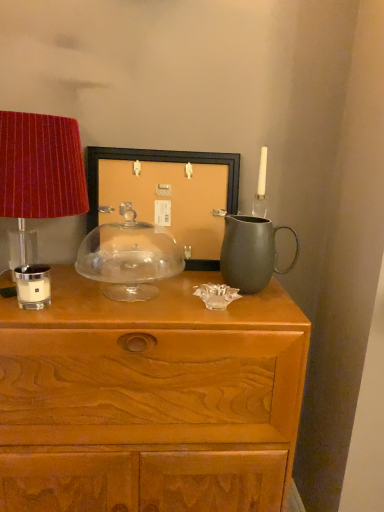
Question: Can we say transparent glass cake stand at center, arranged as the second candle holder when viewed from the left, lies outside matte black picture frame at center?

Choices:
 (A) yes
 (B) no

Answer: (A)

Question: Can you confirm if transparent glass cake stand at center, which is the 1th candle holder from right to left, is smaller than matte black picture frame at center?

Choices:
 (A) yes
 (B) no

Answer: (A)

Question: Considering the relative sizes of transparent glass cake stand at center, which is the 1th candle holder from right to left, and matte black picture frame at center in the image provided, is transparent glass cake stand at center, which is the 1th candle holder from right to left, shorter than matte black picture frame at center?

Choices:
 (A) no
 (B) yes

Answer: (B)

Question: Is transparent glass cake stand at center, which is the 1th candle holder from back to front, at the right side of matte black picture frame at center?

Choices:
 (A) yes
 (B) no

Answer: (B)

Question: Is transparent glass cake stand at center, which is the 1th candle holder from back to front, far from matte black picture frame at center?

Choices:
 (A) no
 (B) yes

Answer: (A)

Question: Is matte black picture frame at center to the left or to the right of transparent glass cake stand at center, placed as the second candle holder when sorted from front to back, in the image?

Choices:
 (A) left
 (B) right

Answer: (B)

Question: Considering the positions of matte black picture frame at center and transparent glass cake stand at center, placed as the second candle holder when sorted from front to back, in the image, is matte black picture frame at center wider or thinner than transparent glass cake stand at center, placed as the second candle holder when sorted from front to back,?

Choices:
 (A) thin
 (B) wide

Answer: (A)

Question: From their relative heights in the image, would you say matte black picture frame at center is taller or shorter than transparent glass cake stand at center, arranged as the second candle holder when viewed from the left?

Choices:
 (A) tall
 (B) short

Answer: (A)

Question: From the image's perspective, is matte black picture frame at center above or below transparent glass cake stand at center, which is the 1th candle holder from right to left?

Choices:
 (A) below
 (B) above

Answer: (B)

Question: Is point (147, 266) closer or farther from the camera than point (198, 184)?

Choices:
 (A) closer
 (B) farther

Answer: (A)

Question: In the image, is transparent glass cake stand at center, which is the 1th candle holder from right to left, on the left side or the right side of matte black picture frame at center?

Choices:
 (A) right
 (B) left

Answer: (B)

Question: From the image's perspective, is transparent glass cake stand at center, arranged as the second candle holder when viewed from the left, above or below matte black picture frame at center?

Choices:
 (A) above
 (B) below

Answer: (B)

Question: From a real-world perspective, relative to matte black picture frame at center, is transparent glass cake stand at center, which is the 1th candle holder from back to front, vertically above or below?

Choices:
 (A) below
 (B) above

Answer: (A)

Question: Does point (1, 150) appear closer or farther from the camera than point (18, 272)?

Choices:
 (A) closer
 (B) farther

Answer: (A)

Question: Choose the correct answer: Is velvet red lampshade at left inside white matte candle holder at left, which is the 1th candle holder from left to right, or outside it?

Choices:
 (A) inside
 (B) outside

Answer: (B)